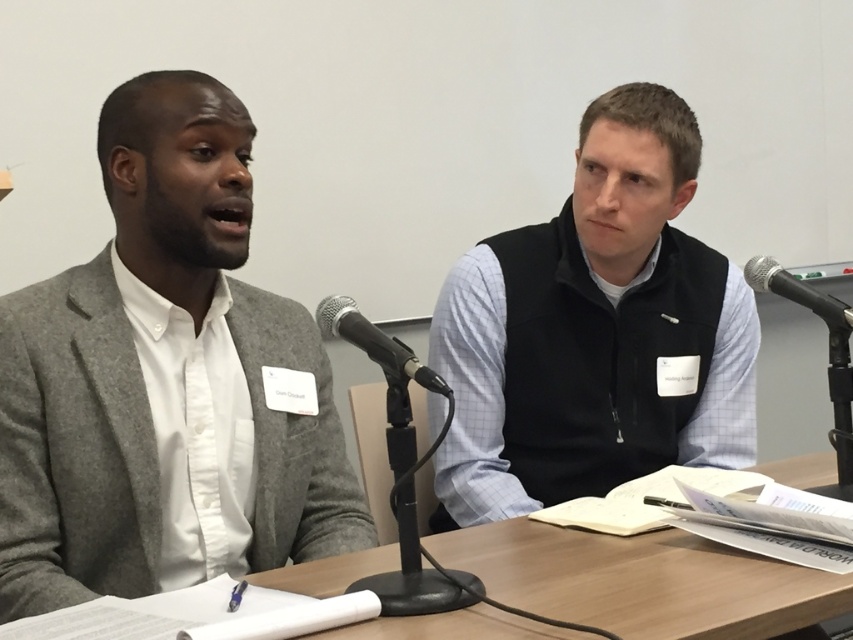
Is point (664, 400) positioned behind point (734, 602)?

That is True.

Between point (508, 260) and point (560, 573), which one is positioned in front?

Point (560, 573)

Is point (462, 257) closer to viewer compared to point (784, 563)?

No, (462, 257) is behind (784, 563).

Image resolution: width=853 pixels, height=640 pixels. I want to click on black vest at center, so click(595, 330).

Between gray woolen blazer at left and black metallic microphone at center, which one is positioned higher?

Positioned higher is gray woolen blazer at left.

You are a GUI agent. You are given a task and a screenshot of the screen. Output one action in this format:
    pyautogui.click(x=<x>, y=<y>)
    Task: Click on the gray woolen blazer at left
    The image size is (853, 640).
    Given the screenshot: What is the action you would take?
    pyautogui.click(x=163, y=381)

Image resolution: width=853 pixels, height=640 pixels. What are the coordinates of `gray woolen blazer at left` in the screenshot? It's located at (163, 381).

Between point (358, 531) and point (527, 449), which one is positioned in front?

Point (358, 531) is more forward.

Can you confirm if gray woolen blazer at left is taller than black vest at center?

In fact, gray woolen blazer at left may be shorter than black vest at center.

Between point (177, 371) and point (442, 515), which one is positioned in front?

Point (177, 371)

The width and height of the screenshot is (853, 640). I want to click on gray woolen blazer at left, so coord(163,381).